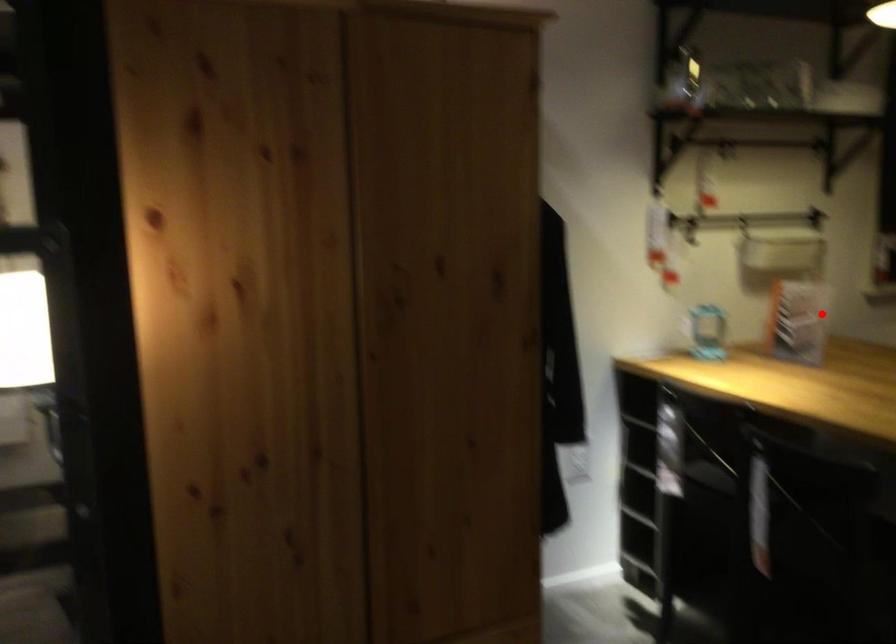
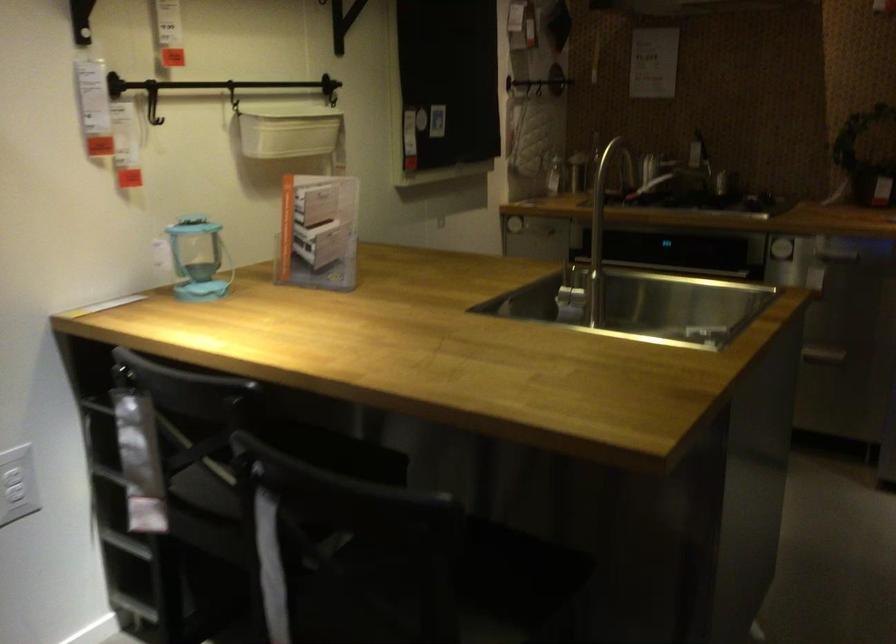
Question: I am providing you with two images of the same scene from different viewpoints. Image1 has a red point marked. In image2, the corresponding 3D location appears at what relative position? Reply with the corresponding letter.

Choices:
 (A) Closer
 (B) Farther

Answer: (A)